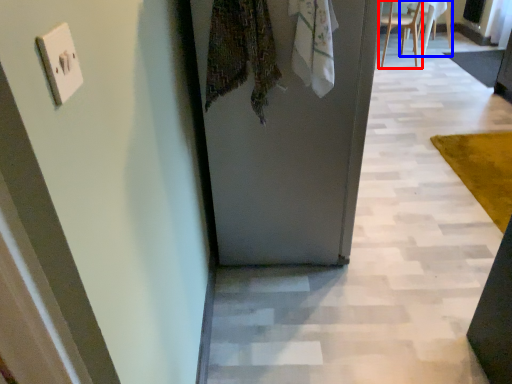
Question: Which object appears closest to the camera in this image, chair (highlighted by a red box) or chair (highlighted by a blue box)?

Choices:
 (A) chair
 (B) chair

Answer: (A)